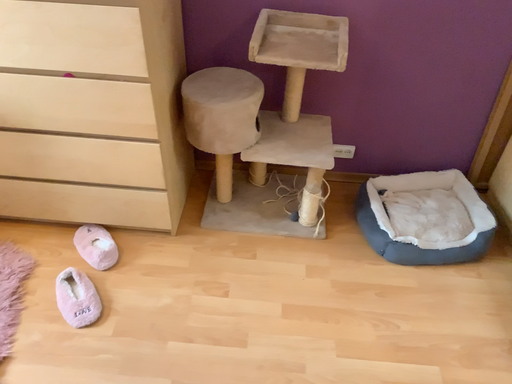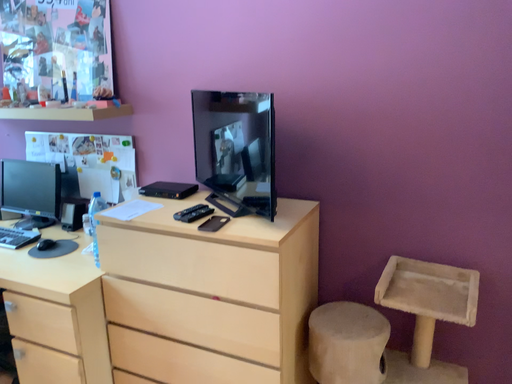
Question: Which way did the camera rotate in the video?

Choices:
 (A) rotated downward
 (B) rotated upward

Answer: (B)